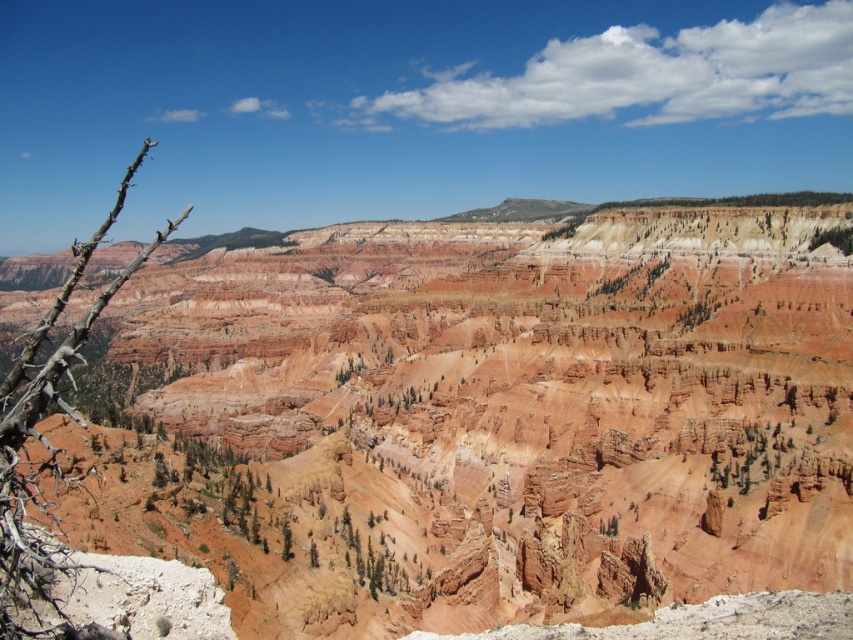
Question: Where is brown thorny branch at left located in relation to green leafy tree at center in the image?

Choices:
 (A) right
 (B) left

Answer: (B)

Question: Which of the following is the farthest from the observer?

Choices:
 (A) green leafy tree at center
 (B) rustic sandstone canyon at center
 (C) brown thorny branch at left

Answer: (A)

Question: Which of the following is the closest to the observer?

Choices:
 (A) tap(811, 244)
 (B) tap(61, 289)
 (C) tap(399, 445)

Answer: (C)

Question: Which point is closer to the camera?

Choices:
 (A) rustic sandstone canyon at center
 (B) green leafy tree at center
 (C) brown thorny branch at left

Answer: (C)

Question: Does brown thorny branch at left have a lesser width compared to green leafy tree at center?

Choices:
 (A) yes
 (B) no

Answer: (B)

Question: Is brown thorny branch at left positioned behind green leafy tree at center?

Choices:
 (A) no
 (B) yes

Answer: (A)